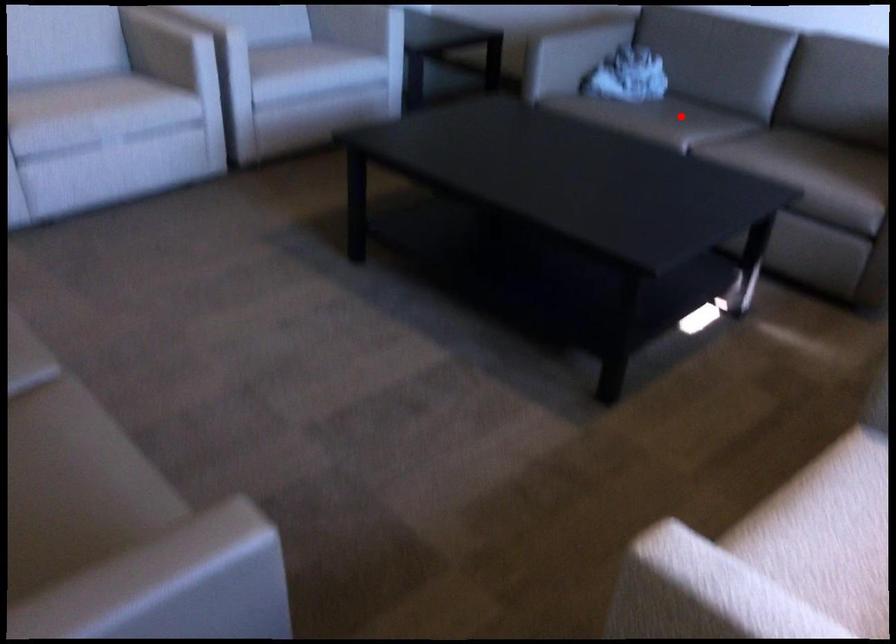
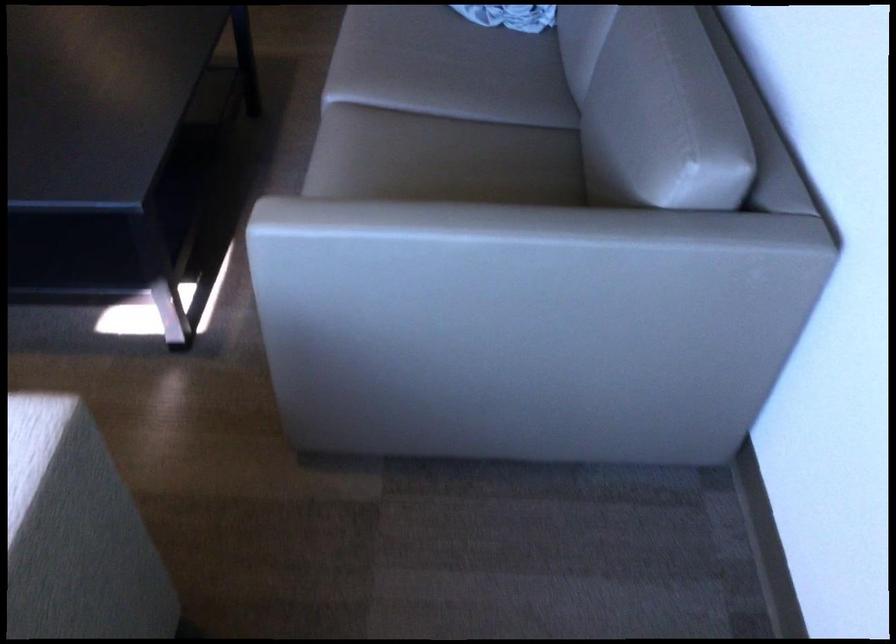
Question: A red point is marked in image1. In image2, is the corresponding 3D point closer to the camera or farther? Reply with the corresponding letter.

Choices:
 (A) The corresponding 3D point is closer.
 (B) The corresponding 3D point is farther.

Answer: (A)